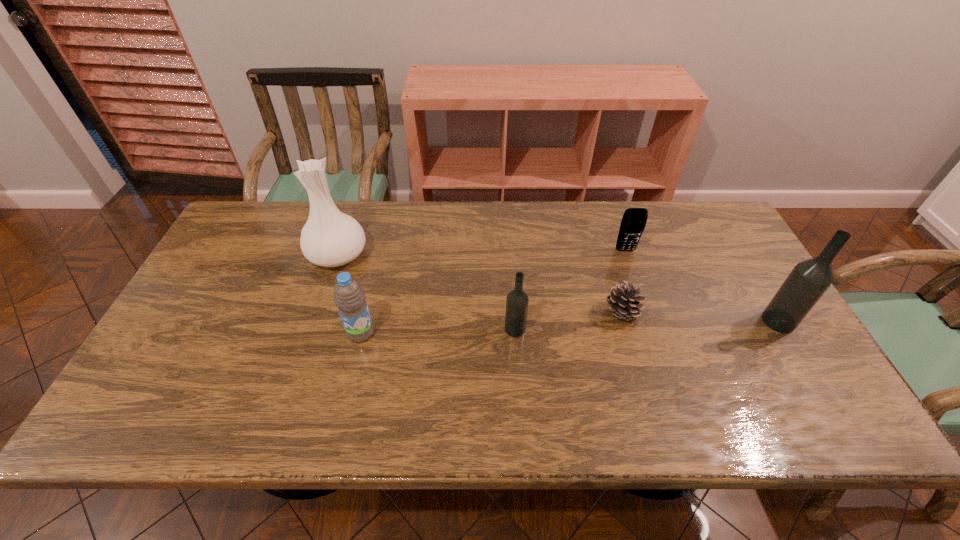
The width and height of the screenshot is (960, 540). In order to click on vacant area situated on the left of the water bottle in this screenshot , I will do `click(280, 333)`.

Where is `vacant space located 0.070m on the right of the shortest object`? vacant space located 0.070m on the right of the shortest object is located at coordinates [x=667, y=313].

The image size is (960, 540). What are the coordinates of `vacant position located on the screen of the cellular telephone` in the screenshot? It's located at (640, 295).

Where is `vacant space situated on the right of the vase`? vacant space situated on the right of the vase is located at coordinates (424, 255).

Image resolution: width=960 pixels, height=540 pixels. I want to click on cellular telephone present at the far edge, so click(633, 222).

Locate an element on the screen. This screenshot has height=540, width=960. vase present at the far edge is located at coordinates (330, 238).

Identify the location of object that is at the right edge. The height and width of the screenshot is (540, 960). (808, 281).

The image size is (960, 540). In order to click on vacant space at the far edge in this screenshot , I will do `click(499, 226)`.

The image size is (960, 540). Identify the location of free location at the near edge. (424, 386).

Where is `free space at the left edge of the desktop`? Image resolution: width=960 pixels, height=540 pixels. free space at the left edge of the desktop is located at coordinates (228, 256).